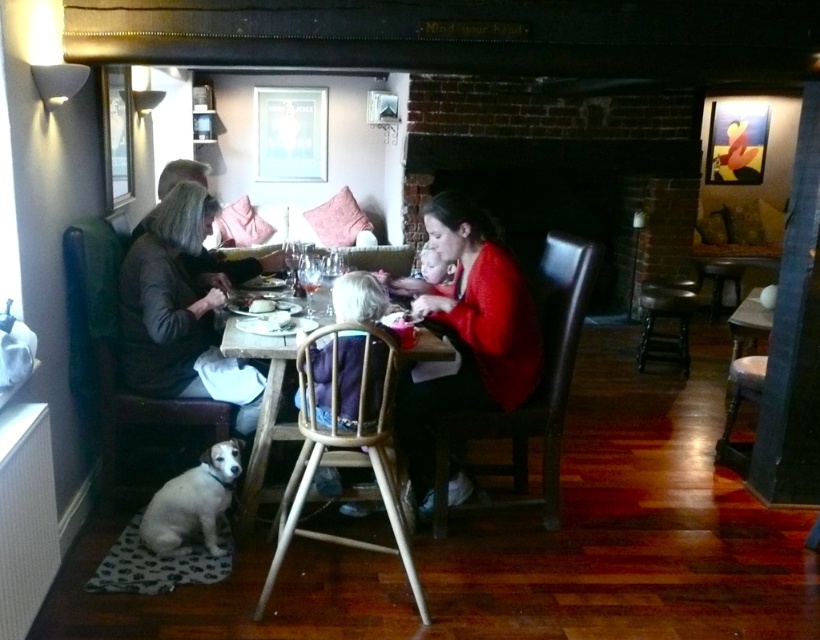
You are a server carrying a tray of dishes. You need to place the tray between the red matte sweater at center and the metallic stool at center right. Can you fit the tray there if the tray is 1.2 meters wide?

The red matte sweater at center is narrower than the metallic stool at center right, but the exact width difference isn

You are a server at the restaurant and need to place a 1.2 meter long tray between the dark gray sweater at left and the white fur dog at lower left. Can the tray fit without touching either?

The dark gray sweater at left might be wider than white fur dog at lower left, but the exact width difference is unknown. Therefore, it is uncertain whether the 1.2 meter long tray can fit between them without touching either object.